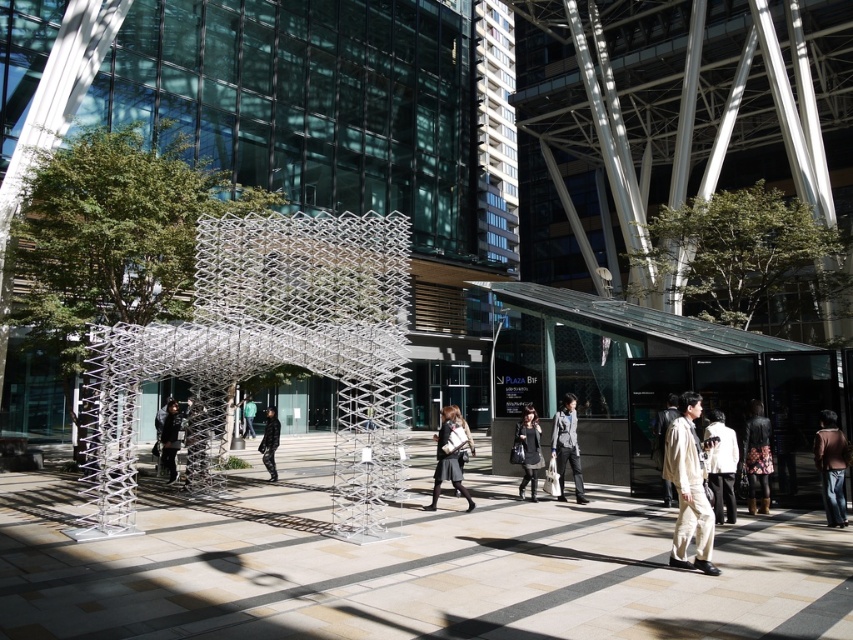
You are a photographer planning to capture a photo of the brown leather jacket at lower right and the dark gray fabric bag at center in the urban plaza. Which object should you focus on first if you want to highlight the size difference between them?

You should focus on the brown leather jacket at lower right first since it has a larger size compared to the dark gray fabric bag at center, making the size difference more prominent in the photo.